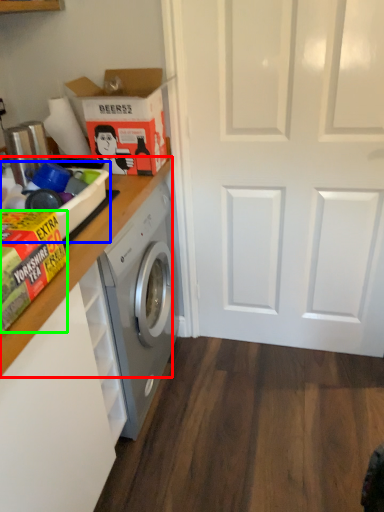
Question: Which object is the farthest from counter top (highlighted by a red box)? Choose among these: box (highlighted by a blue box) or cardboard box (highlighted by a green box).

Choices:
 (A) box
 (B) cardboard box

Answer: (B)